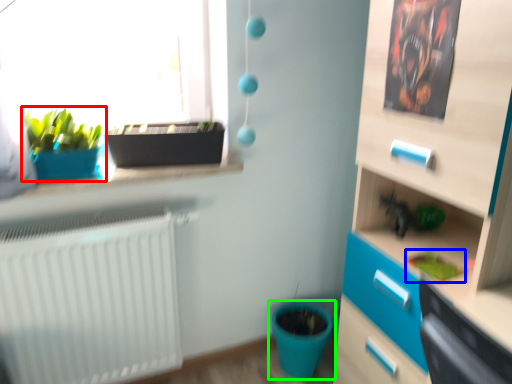
Question: Considering the real-world distances, which object is farthest from houseplant (highlighted by a red box)? plant (highlighted by a blue box) or flowerpot (highlighted by a green box)?

Choices:
 (A) plant
 (B) flowerpot

Answer: (B)